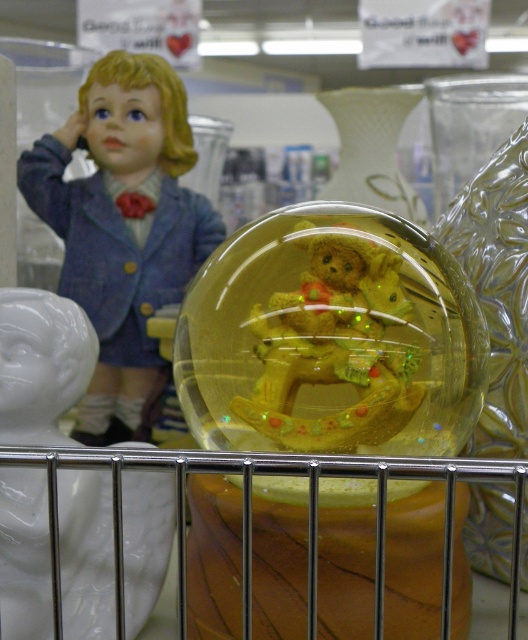
Is matte blue fabric doll at upper left thinner than translucent yellow bear at center?

No, matte blue fabric doll at upper left is not thinner than translucent yellow bear at center.

Between matte blue fabric doll at upper left and translucent yellow bear at center, which one appears on the right side from the viewer's perspective?

From the viewer's perspective, translucent yellow bear at center appears more on the right side.

Between point (115, 296) and point (300, 378), which one is positioned behind?

The point (115, 296) is behind.

What are the coordinates of `matte blue fabric doll at upper left` in the screenshot? It's located at (122, 227).